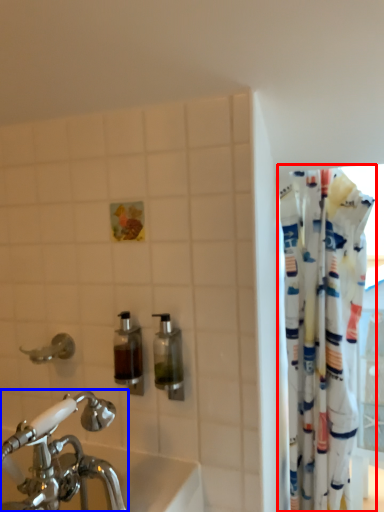
Question: Which object is further to the camera taking this photo, curtain (highlighted by a red box) or tap (highlighted by a blue box)?

Choices:
 (A) curtain
 (B) tap

Answer: (A)